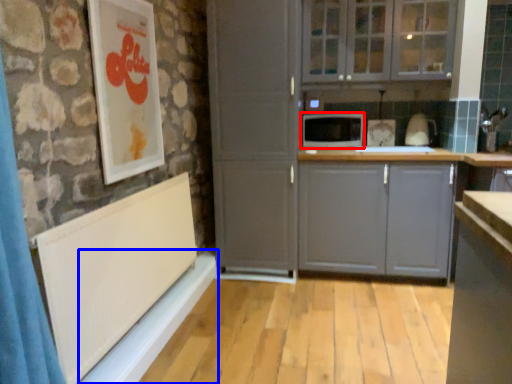
Question: Which of the following is the closest to the observer, microwave oven (highlighted by a red box) or window sill (highlighted by a blue box)?

Choices:
 (A) microwave oven
 (B) window sill

Answer: (B)